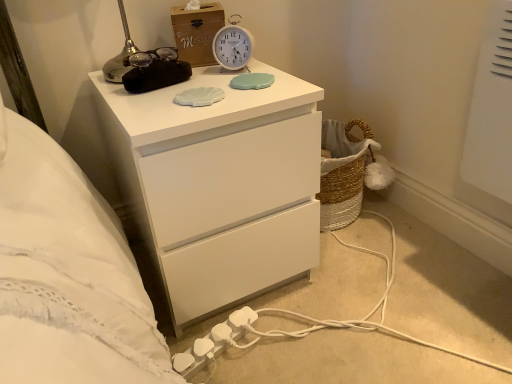
Find the location of a particular element. The height and width of the screenshot is (384, 512). unoccupied region to the right of white plastic extension cord at lower center is located at coordinates (285, 341).